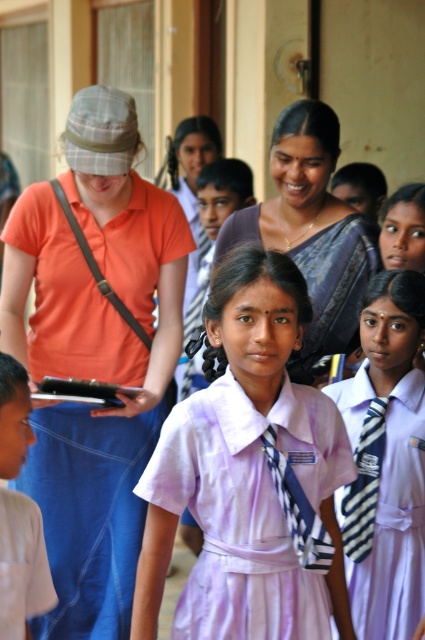
Question: Which object is closer to the camera taking this photo?

Choices:
 (A) purple fabric dress at center
 (B) purple silk saree at center
 (C) striped fabric tie at center
 (D) white uniform at center

Answer: (D)

Question: Is purple silk saree at center wider than white uniform at center?

Choices:
 (A) yes
 (B) no

Answer: (A)

Question: Which point is farther to the camera?

Choices:
 (A) (286, 474)
 (B) (354, 483)
 (C) (36, 577)

Answer: (B)

Question: Which object is the closest to the white uniform at center?

Choices:
 (A) striped fabric tie at center
 (B) purple school uniform at center
 (C) blue striped tie at center

Answer: (C)

Question: Can you confirm if purple silk saree at center is positioned to the right of blue striped tie at center?

Choices:
 (A) no
 (B) yes

Answer: (A)

Question: Considering the relative positions of orange cotton shirt at center and white uniform at center in the image provided, where is orange cotton shirt at center located with respect to white uniform at center?

Choices:
 (A) right
 (B) left

Answer: (A)